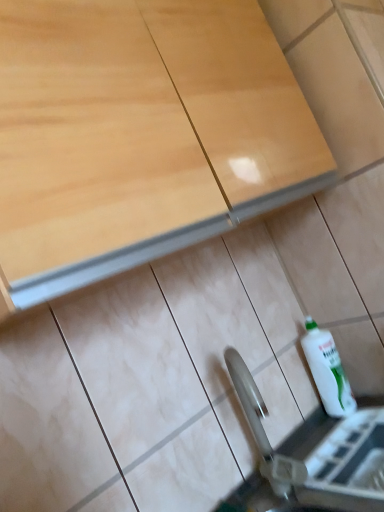
Question: Is matte wood cabinet at upper center to the left of metallic silver sink at lower center from the viewer's perspective?

Choices:
 (A) yes
 (B) no

Answer: (A)

Question: Is the position of matte wood cabinet at upper center less distant than that of metallic silver sink at lower center?

Choices:
 (A) no
 (B) yes

Answer: (B)

Question: Does matte wood cabinet at upper center touch metallic silver sink at lower center?

Choices:
 (A) yes
 (B) no

Answer: (B)

Question: Does matte wood cabinet at upper center have a lesser height compared to metallic silver sink at lower center?

Choices:
 (A) yes
 (B) no

Answer: (B)

Question: From the image's perspective, is matte wood cabinet at upper center located beneath metallic silver sink at lower center?

Choices:
 (A) no
 (B) yes

Answer: (A)

Question: Is metallic silver sink at lower center to the left or to the right of matte wood cabinet at upper center in the image?

Choices:
 (A) left
 (B) right

Answer: (B)

Question: From their relative heights in the image, would you say metallic silver sink at lower center is taller or shorter than matte wood cabinet at upper center?

Choices:
 (A) short
 (B) tall

Answer: (A)

Question: Is metallic silver sink at lower center wider or thinner than matte wood cabinet at upper center?

Choices:
 (A) wide
 (B) thin

Answer: (A)

Question: Relative to matte wood cabinet at upper center, is metallic silver sink at lower center in front or behind?

Choices:
 (A) front
 (B) behind

Answer: (B)

Question: Considering the positions of matte wood cabinet at upper center and white glossy bottle at lower right in the image, is matte wood cabinet at upper center bigger or smaller than white glossy bottle at lower right?

Choices:
 (A) big
 (B) small

Answer: (A)

Question: Is matte wood cabinet at upper center wider or thinner than white glossy bottle at lower right?

Choices:
 (A) thin
 (B) wide

Answer: (B)

Question: Is point click(x=190, y=134) closer or farther from the camera than point click(x=349, y=408)?

Choices:
 (A) farther
 (B) closer

Answer: (B)

Question: Choose the correct answer: Is matte wood cabinet at upper center inside white glossy bottle at lower right or outside it?

Choices:
 (A) inside
 (B) outside

Answer: (B)

Question: Is point click(x=327, y=410) closer or farther from the camera than point click(x=41, y=283)?

Choices:
 (A) farther
 (B) closer

Answer: (A)

Question: Which is correct: white glossy bottle at lower right is inside matte wood cabinet at upper center, or outside of it?

Choices:
 (A) inside
 (B) outside

Answer: (B)